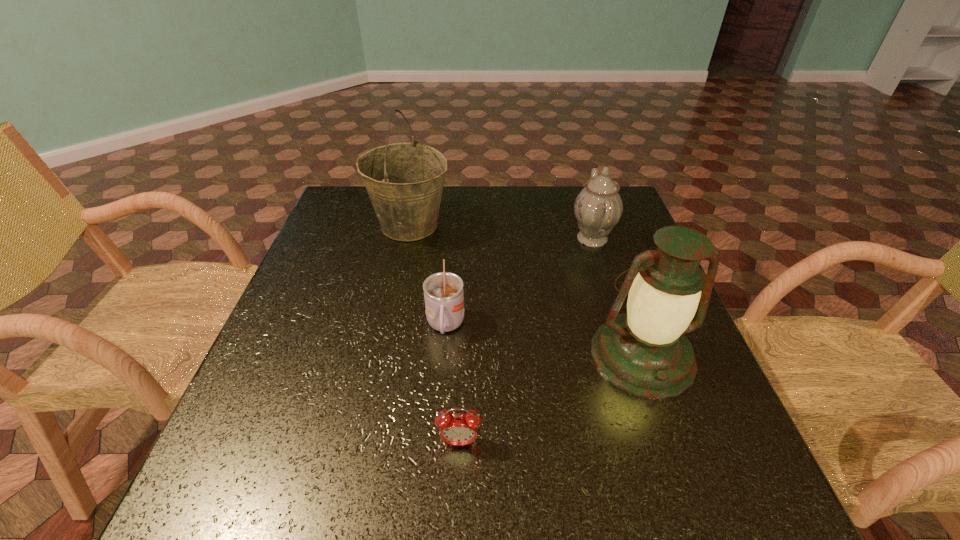
Where is `free space at the far edge`? free space at the far edge is located at coordinates (492, 195).

You are a GUI agent. You are given a task and a screenshot of the screen. Output one action in this format:
    pyautogui.click(x=<x>, y=<y>)
    Task: Click on the vacant space at the near edge
    
    Given the screenshot: What is the action you would take?
    pyautogui.click(x=621, y=509)

Where is `free space at the left edge of the desktop`? The width and height of the screenshot is (960, 540). free space at the left edge of the desktop is located at coordinates (277, 429).

Where is `blank space at the near right corner`? blank space at the near right corner is located at coordinates (670, 476).

I want to click on unoccupied position between the lantern and the cup, so click(x=544, y=341).

In order to click on empty space between the wine bucket and the cup in this screenshot , I will do `click(427, 276)`.

The width and height of the screenshot is (960, 540). Identify the location of vacant region between the third tallest object and the shortest object. (526, 340).

Find the location of a particular element. Image resolution: width=960 pixels, height=540 pixels. free space that is in between the lantern and the wine bucket is located at coordinates (525, 291).

I want to click on vacant area that lies between the alarm clock and the third shortest object, so pyautogui.click(x=526, y=340).

Image resolution: width=960 pixels, height=540 pixels. I want to click on free space between the shortest object and the third tallest object, so click(x=526, y=340).